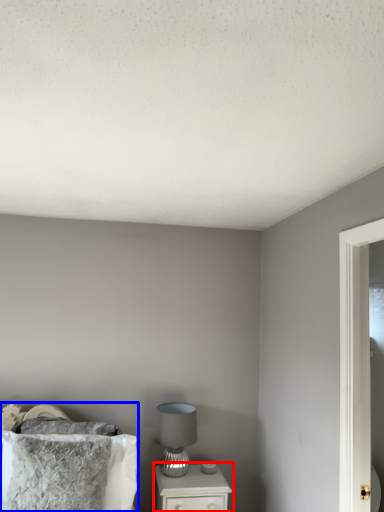
Question: Which object appears farthest to the camera in this image, nightstand (highlighted by a red box) or bed (highlighted by a blue box)?

Choices:
 (A) nightstand
 (B) bed

Answer: (A)